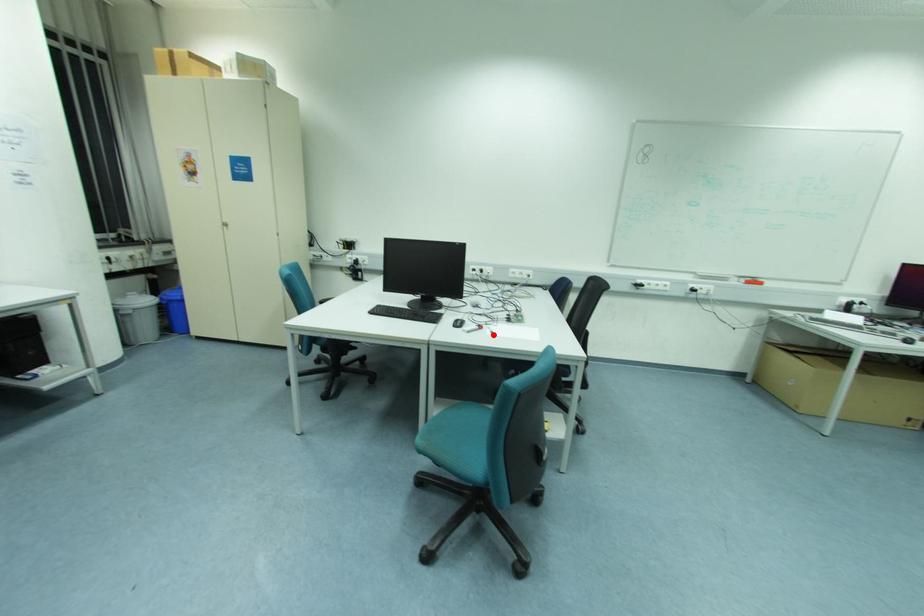
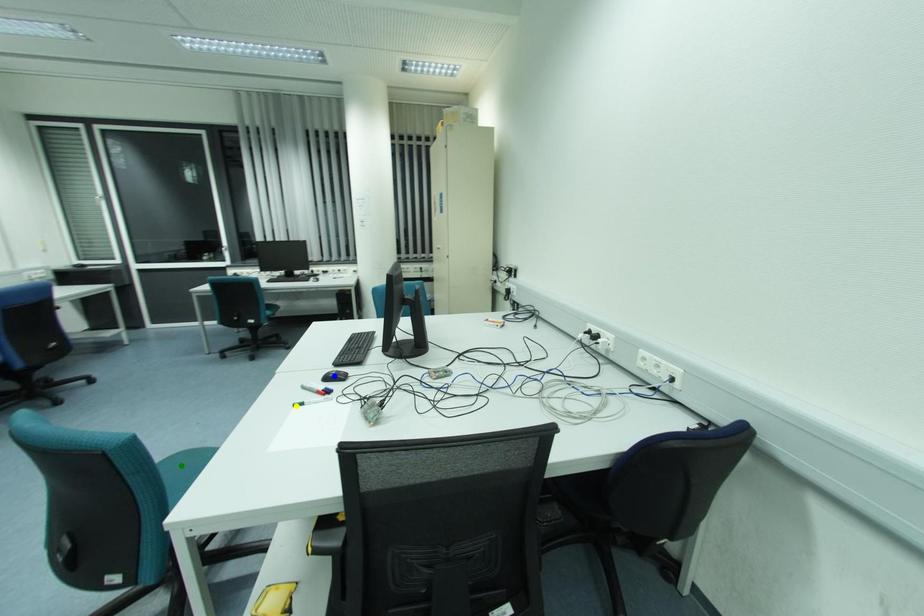
Question: I am providing you with two images of the same scene from different viewpoints. A red point is marked on the first image. You are given multiple points on the second image. Which point in image 2 represents the same 3d spot as the red point in image 1?

Choices:
 (A) green point
 (B) yellow point
 (C) blue point

Answer: (B)